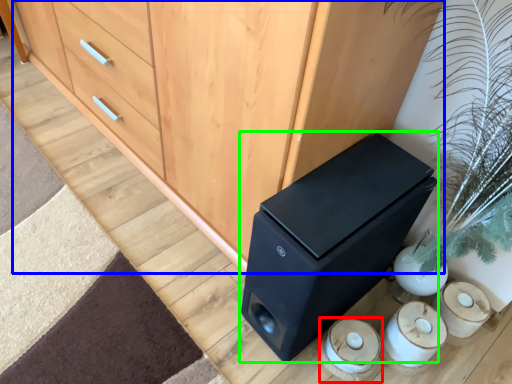
Question: Which is farther away from candle holder (highlighted by a red box)? chest of drawers (highlighted by a blue box) or furniture (highlighted by a green box)?

Choices:
 (A) chest of drawers
 (B) furniture

Answer: (A)